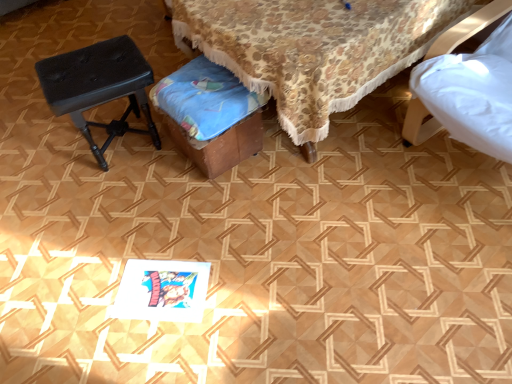
Question: Should I look upward or downward to see black leather stool at left?

Choices:
 (A) down
 (B) up

Answer: (B)

Question: From a real-world perspective, is wooden stool at center located higher than black leather stool at left?

Choices:
 (A) yes
 (B) no

Answer: (A)

Question: Is black leather stool at left a part of wooden stool at center?

Choices:
 (A) yes
 (B) no

Answer: (B)

Question: Can you confirm if wooden stool at center is thinner than black leather stool at left?

Choices:
 (A) no
 (B) yes

Answer: (A)

Question: Can you confirm if wooden stool at center is shorter than black leather stool at left?

Choices:
 (A) no
 (B) yes

Answer: (A)

Question: Could you tell me if wooden stool at center is facing black leather stool at left?

Choices:
 (A) no
 (B) yes

Answer: (B)

Question: Is wooden stool at center facing away from black leather stool at left?

Choices:
 (A) yes
 (B) no

Answer: (B)

Question: Considering the relative sizes of black leather stool at left and wooden stool at center in the image provided, is black leather stool at left smaller than wooden stool at center?

Choices:
 (A) no
 (B) yes

Answer: (B)

Question: Does black leather stool at left have a lesser width compared to wooden stool at center?

Choices:
 (A) no
 (B) yes

Answer: (B)

Question: Could wooden stool at center be considered to be inside black leather stool at left?

Choices:
 (A) no
 (B) yes

Answer: (A)

Question: From the image's perspective, is black leather stool at left below wooden stool at center?

Choices:
 (A) yes
 (B) no

Answer: (A)

Question: Can you confirm if black leather stool at left is positioned to the right of wooden stool at center?

Choices:
 (A) yes
 (B) no

Answer: (B)

Question: Are black leather stool at left and wooden stool at center located far from each other?

Choices:
 (A) no
 (B) yes

Answer: (A)

Question: From the image's perspective, is black leather stool at left on top of wooden music stool at center?

Choices:
 (A) no
 (B) yes

Answer: (B)